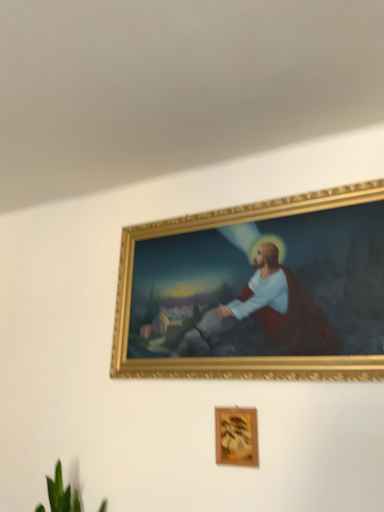
Question: Is wooden frame at lower center, arranged as the first picture frame when ordered from the bottom, not within green leafy plant at lower left?

Choices:
 (A) yes
 (B) no

Answer: (A)

Question: Considering the relative sizes of wooden frame at lower center, placed as the second picture frame when sorted from right to left, and green leafy plant at lower left in the image provided, is wooden frame at lower center, placed as the second picture frame when sorted from right to left, shorter than green leafy plant at lower left?

Choices:
 (A) no
 (B) yes

Answer: (B)

Question: Is wooden frame at lower center, which is the first picture frame in left-to-right order, behind green leafy plant at lower left?

Choices:
 (A) yes
 (B) no

Answer: (A)

Question: From the image's perspective, is wooden frame at lower center, arranged as the first picture frame when ordered from the bottom, located above green leafy plant at lower left?

Choices:
 (A) no
 (B) yes

Answer: (B)

Question: Is wooden frame at lower center, which is the first picture frame in left-to-right order, thinner than green leafy plant at lower left?

Choices:
 (A) no
 (B) yes

Answer: (B)

Question: In the image, is green leafy plant at lower left positioned in front of or behind gold/gilded picture frame at upper center, positioned as the second picture frame in left-to-right order?

Choices:
 (A) behind
 (B) front

Answer: (A)

Question: Is green leafy plant at lower left wider or thinner than gold/gilded picture frame at upper center, positioned as the second picture frame in left-to-right order?

Choices:
 (A) wide
 (B) thin

Answer: (A)

Question: Is green leafy plant at lower left situated inside gold/gilded picture frame at upper center, acting as the 2th picture frame starting from the bottom, or outside?

Choices:
 (A) outside
 (B) inside

Answer: (A)

Question: From a real-world perspective, is green leafy plant at lower left positioned above or below gold/gilded picture frame at upper center, acting as the 2th picture frame starting from the bottom?

Choices:
 (A) above
 (B) below

Answer: (B)

Question: Is wooden frame at lower center, positioned as the second picture frame in top-to-bottom order, bigger or smaller than gold/gilded picture frame at upper center, positioned as the 1th picture frame in top-to-bottom order?

Choices:
 (A) big
 (B) small

Answer: (B)

Question: From a real-world perspective, is wooden frame at lower center, which is the first picture frame in left-to-right order, above or below gold/gilded picture frame at upper center, positioned as the 1th picture frame in top-to-bottom order?

Choices:
 (A) below
 (B) above

Answer: (A)

Question: Relative to gold/gilded picture frame at upper center, acting as the 2th picture frame starting from the bottom, is wooden frame at lower center, arranged as the first picture frame when ordered from the bottom, in front or behind?

Choices:
 (A) behind
 (B) front

Answer: (A)

Question: Considering the positions of wooden frame at lower center, placed as the second picture frame when sorted from right to left, and gold/gilded picture frame at upper center, positioned as the second picture frame in left-to-right order, in the image, is wooden frame at lower center, placed as the second picture frame when sorted from right to left, wider or thinner than gold/gilded picture frame at upper center, positioned as the second picture frame in left-to-right order,?

Choices:
 (A) wide
 (B) thin

Answer: (B)

Question: Considering the positions of green leafy plant at lower left and wooden frame at lower center, placed as the second picture frame when sorted from right to left, in the image, is green leafy plant at lower left wider or thinner than wooden frame at lower center, placed as the second picture frame when sorted from right to left,?

Choices:
 (A) wide
 (B) thin

Answer: (A)

Question: From a real-world perspective, is green leafy plant at lower left above or below wooden frame at lower center, placed as the second picture frame when sorted from right to left?

Choices:
 (A) below
 (B) above

Answer: (A)